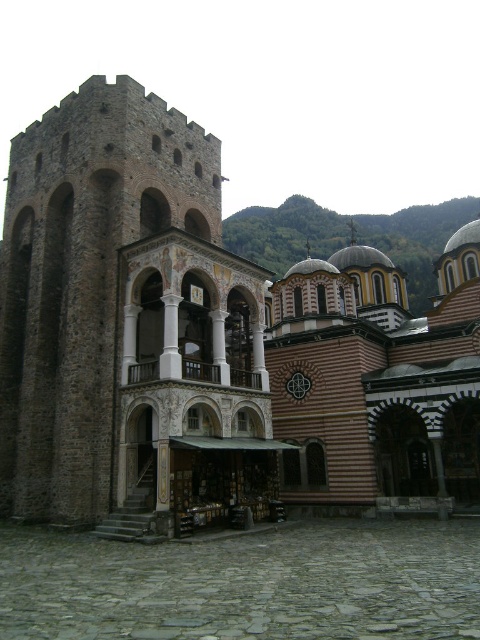
You are standing in the cobblestone courtyard and want to walk from the point closer to you to the point further away. Which path should you take between the two points, point (62, 208) and point (82, 556)?

You should walk from point (62, 208) to point (82, 556) because point (62, 208) is closer to you and point (82, 556) is further away.

You are an architect visiting this historical site. You need to determine which object occupies more space in the image between the brown stone tower at left and the gray cobblestone courtyard at center. Based on the scene, which one is larger?

The brown stone tower at left is bigger than the gray cobblestone courtyard at center, so the brown stone tower at left occupies more space in the image.

You are a tourist standing in the gray cobblestone courtyard at center and want to take a photo of the brown stone tower at left. If your camera has a maximum zoom range that can capture objects up to 60 feet away, will you be able to get a clear photo of the tower without moving closer?

The brown stone tower at left and gray cobblestone courtyard at center are 63.58 feet apart. Since the distance exceeds the camera maximum zoom range of 60 feet, you won t be able to get a clear photo of the tower without moving closer.